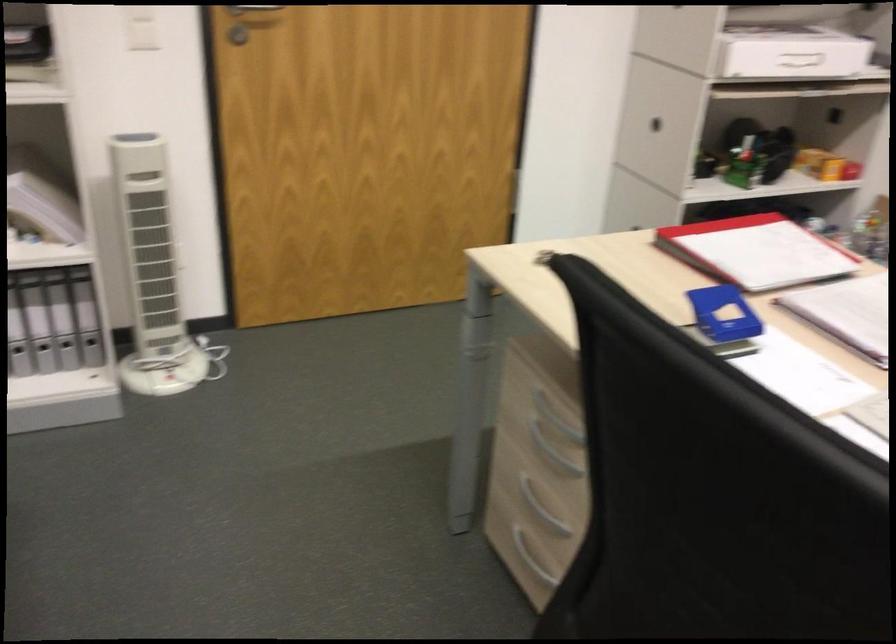
Where would you lift the white storage box? Please return your answer as a coordinate pair (x, y).

(790, 53)